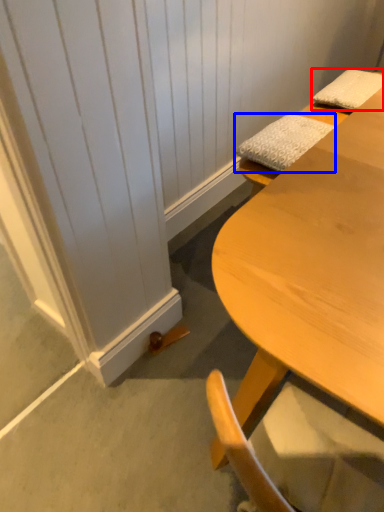
Question: Which of the following is the closest to the observer, pillow (highlighted by a red box) or pillow (highlighted by a blue box)?

Choices:
 (A) pillow
 (B) pillow

Answer: (B)